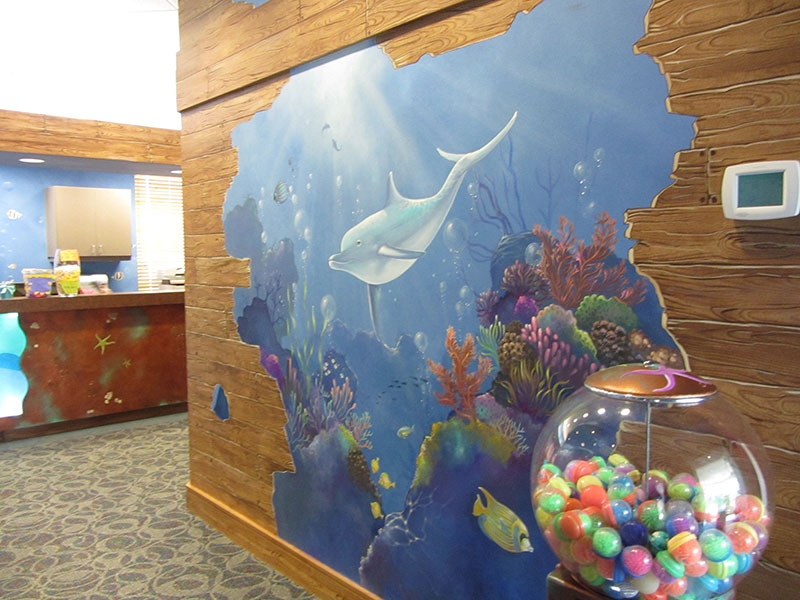
Find the location of a particular element. The height and width of the screenshot is (600, 800). thermostat is located at coordinates (770, 197).